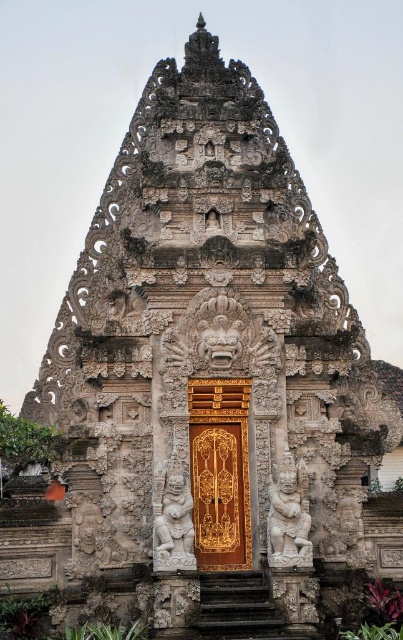
Which is in front, point (280, 518) or point (180, 525)?

Positioned in front is point (180, 525).

In the scene shown: Which is more to the right, white stone deity at lower center or white stone deity at center?

white stone deity at lower center

This screenshot has height=640, width=403. What do you see at coordinates (288, 515) in the screenshot?
I see `white stone deity at lower center` at bounding box center [288, 515].

Find the location of `white stone deity at lower center`. white stone deity at lower center is located at coordinates (288, 515).

Can you confirm if dark gray stone stairs at center is shorter than white stone deity at lower center?

No, dark gray stone stairs at center is not shorter than white stone deity at lower center.

Who is lower down, dark gray stone stairs at center or white stone deity at lower center?

dark gray stone stairs at center

This screenshot has height=640, width=403. What do you see at coordinates (236, 608) in the screenshot?
I see `dark gray stone stairs at center` at bounding box center [236, 608].

Find the location of `dark gray stone stairs at center`. dark gray stone stairs at center is located at coordinates (236, 608).

Who is taller, gold polished wood door at center or white stone deity at lower center?

gold polished wood door at center is taller.

Is gold polished wood door at center positioned before white stone deity at lower center?

No, gold polished wood door at center is further to the viewer.

Measure the distance between gold polished wood door at center and camera.

gold polished wood door at center is 258.49 feet from camera.

Locate an element on the screen. gold polished wood door at center is located at coordinates (220, 472).